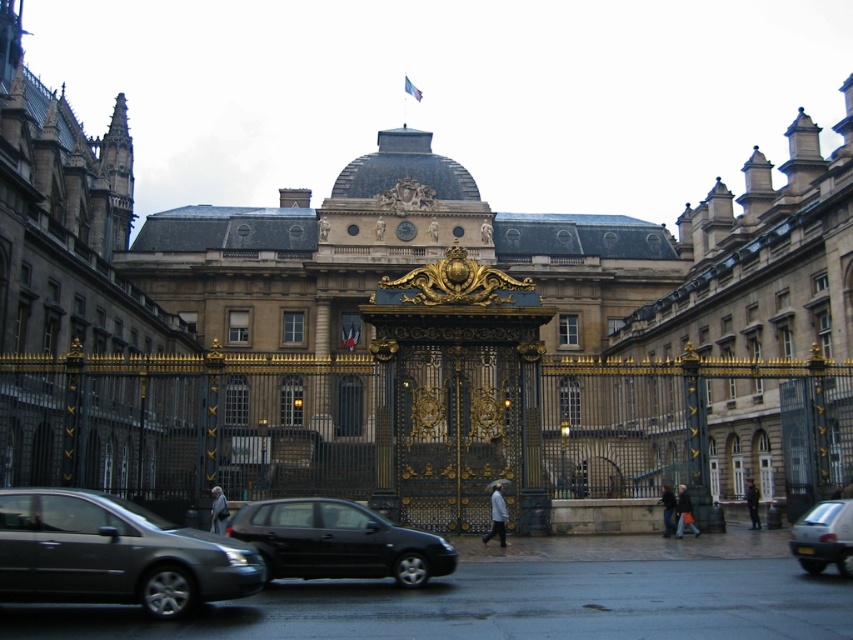
You are a visitor approaching the ornate, golden gate in front of the historic building. You notice a metallic gray sedan at lower left. Based on its 2D coordinates, is the sedan closer to the gate or the building?

The metallic gray sedan at lower left is located at point 0.867 on the x axis and 0.135 on the y axis. Since the gate is in front of the building, the sedan is closer to the gate than the building.

You are standing in front of the historic building and notice two points marked on the ground. The first point is at coordinate point (294, 576) and the second is at point (817, 504). Which point is closer to the ornate golden gate?

Point (294, 576) is in front of point (817, 504), so it is closer to the ornate golden gate.